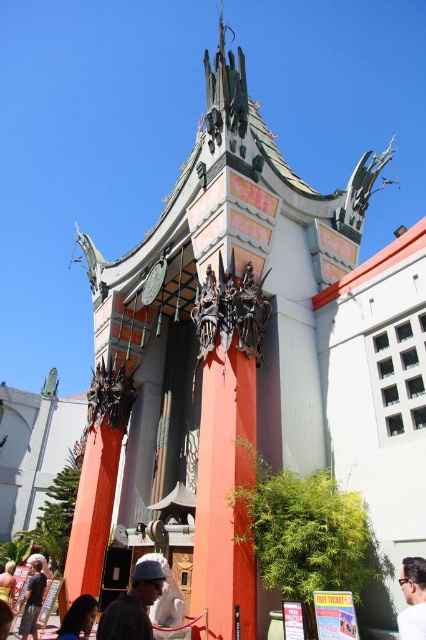
You are a tourist standing in front of this ornate building and notice two items in the scene. One is a matte gray helmet at center and the other is dark brown hair at lower left. From your vantage point, which item appears closer to you?

The matte gray helmet at center appears closer to you because it is positioned in front of the dark brown hair at lower left.